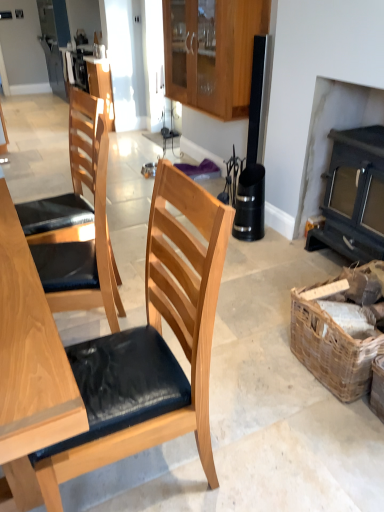
Question: Should I look upward or downward to see dark gray wood fireplace at right?

Choices:
 (A) down
 (B) up

Answer: (B)

Question: From the image's perspective, is wooden chair with cushion at center, which is the 1th chair from bottom to top, on top of woven brown picnic basket at lower right?

Choices:
 (A) no
 (B) yes

Answer: (A)

Question: From the image's perspective, would you say wooden chair with cushion at center, which is the 1th chair from bottom to top, is shown under woven brown picnic basket at lower right?

Choices:
 (A) no
 (B) yes

Answer: (B)

Question: Is wooden chair with cushion at center, which is the 1th chair from bottom to top, further to camera compared to woven brown picnic basket at lower right?

Choices:
 (A) yes
 (B) no

Answer: (B)

Question: Does wooden chair with cushion at center, the 2th chair viewed from the top, have a larger size compared to woven brown picnic basket at lower right?

Choices:
 (A) yes
 (B) no

Answer: (A)

Question: Considering the relative sizes of wooden chair with cushion at center, the 2th chair viewed from the top, and woven brown picnic basket at lower right in the image provided, is wooden chair with cushion at center, the 2th chair viewed from the top, taller than woven brown picnic basket at lower right?

Choices:
 (A) no
 (B) yes

Answer: (B)

Question: Is the depth of wooden chair with cushion at center, which is the 1th chair from bottom to top, less than that of woven brown picnic basket at lower right?

Choices:
 (A) yes
 (B) no

Answer: (A)

Question: From the image's perspective, does matte wood cabinet at upper center, which is the second cabinetry in right-to-left order, appear higher than dark gray wood fireplace at right?

Choices:
 (A) no
 (B) yes

Answer: (B)

Question: Is matte wood cabinet at upper center, arranged as the first cabinetry when viewed from the left, positioned behind dark gray wood fireplace at right?

Choices:
 (A) no
 (B) yes

Answer: (B)

Question: Could you tell me if matte wood cabinet at upper center, the first cabinetry in the back-to-front sequence, is facing dark gray wood fireplace at right?

Choices:
 (A) yes
 (B) no

Answer: (B)

Question: From the image's perspective, is matte wood cabinet at upper center, arranged as the first cabinetry when viewed from the left, located beneath dark gray wood fireplace at right?

Choices:
 (A) no
 (B) yes

Answer: (A)

Question: Can you confirm if matte wood cabinet at upper center, arranged as the first cabinetry when viewed from the left, is thinner than dark gray wood fireplace at right?

Choices:
 (A) no
 (B) yes

Answer: (B)

Question: Considering the relative sizes of matte wood cabinet at upper center, which ranks as the 2th cabinetry in front-to-back order, and dark gray wood fireplace at right in the image provided, is matte wood cabinet at upper center, which ranks as the 2th cabinetry in front-to-back order, taller than dark gray wood fireplace at right?

Choices:
 (A) no
 (B) yes

Answer: (A)

Question: From the image's perspective, is dark gray wood fireplace at right below light brown wood chair at left, which appears as the 2th chair when ordered from the bottom?

Choices:
 (A) yes
 (B) no

Answer: (B)